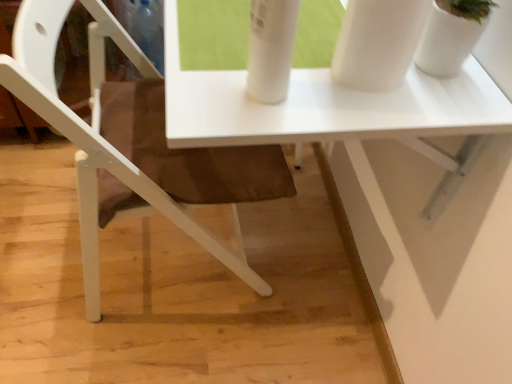
Where is `free location to the left of white glossy vase at upper right`? free location to the left of white glossy vase at upper right is located at coordinates (321, 74).